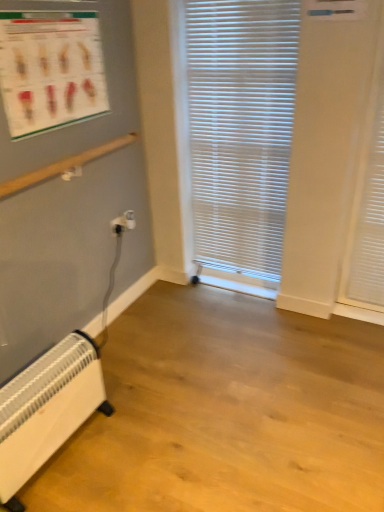
Question: Considering the positions of white plastic electrical outlet at lower left and white plastic heater at lower left in the image, is white plastic electrical outlet at lower left taller or shorter than white plastic heater at lower left?

Choices:
 (A) short
 (B) tall

Answer: (A)

Question: Visually, is white plastic electrical outlet at lower left positioned to the left or to the right of white plastic heater at lower left?

Choices:
 (A) right
 (B) left

Answer: (A)

Question: Estimate the real-world distances between objects in this image. Which object is farther from the white plastic heater at lower left?

Choices:
 (A) white plastic blinds at center
 (B) white plastic electrical outlet at lower left
 (C) matte plastic poster at upper left
 (D) white matte shutter at right

Answer: (D)

Question: Which object is positioned farthest from the white plastic electrical outlet at lower left?

Choices:
 (A) matte plastic poster at upper left
 (B) white matte shutter at right
 (C) white plastic heater at lower left
 (D) white plastic blinds at center

Answer: (B)